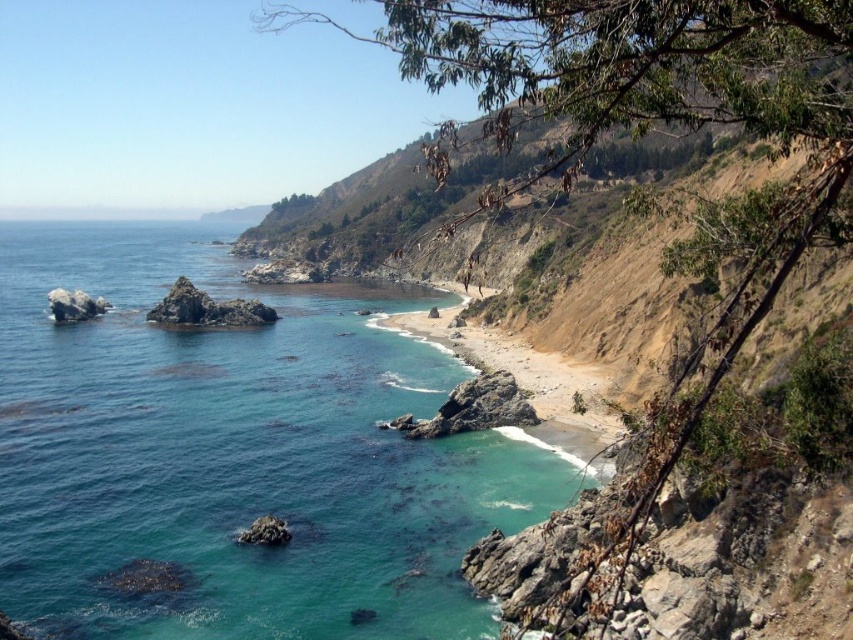
Who is lower down, rusty rock at center-left or gray rock at left?

Positioned lower is rusty rock at center-left.

Is point (172, 294) positioned behind point (91, 305)?

No, it is not.

The height and width of the screenshot is (640, 853). In order to click on rusty rock at center-left in this screenshot , I will do `click(207, 308)`.

Is clear blue water at lower left to the left of sandy beach at lower center from the viewer's perspective?

Indeed, clear blue water at lower left is positioned on the left side of sandy beach at lower center.

Does clear blue water at lower left appear on the right side of sandy beach at lower center?

No, clear blue water at lower left is not to the right of sandy beach at lower center.

What do you see at coordinates (235, 454) in the screenshot? I see `clear blue water at lower left` at bounding box center [235, 454].

At what (x,y) coordinates should I click in order to perform the action: click on clear blue water at lower left. Please return your answer as a coordinate pair (x, y). This screenshot has width=853, height=640. Looking at the image, I should click on (235, 454).

Is sandy beach at lower center taller than gray rock at left?

Correct, sandy beach at lower center is much taller as gray rock at left.

Does point (567, 387) lie in front of point (65, 321)?

Yes.

Who is more distant from viewer, (x=489, y=349) or (x=90, y=316)?

The point (x=90, y=316) is behind.

Locate an element on the screen. sandy beach at lower center is located at coordinates (525, 378).